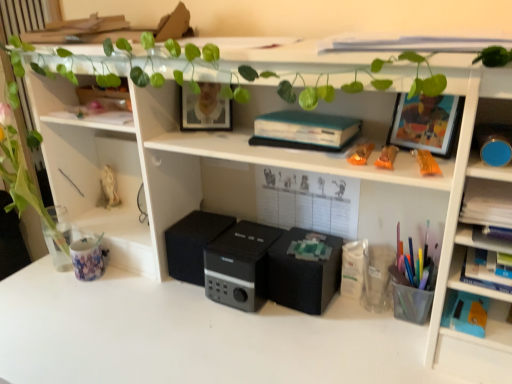
Question: Which direction should I rotate to face black matte speaker at center, which is the 1th speaker in left-to-right order, — up or down?

Choices:
 (A) up
 (B) down

Answer: (B)

Question: Is teal matte book at center in front of hardcover book at right?

Choices:
 (A) no
 (B) yes

Answer: (A)

Question: Can you confirm if teal matte book at center is smaller than hardcover book at right?

Choices:
 (A) no
 (B) yes

Answer: (B)

Question: Does teal matte book at center appear on the right side of hardcover book at right?

Choices:
 (A) yes
 (B) no

Answer: (B)

Question: From the image's perspective, is teal matte book at center located beneath hardcover book at right?

Choices:
 (A) yes
 (B) no

Answer: (B)

Question: Considering the relative sizes of teal matte book at center and hardcover book at right in the image provided, is teal matte book at center wider than hardcover book at right?

Choices:
 (A) yes
 (B) no

Answer: (B)

Question: Is teal matte book at center outside of hardcover book at right?

Choices:
 (A) yes
 (B) no

Answer: (A)

Question: Are translucent orange pen at upper right, arranged as the 2th stationery when viewed from the right, and black matte speaker at center, the 3th speaker in the left-to-right sequence, making contact?

Choices:
 (A) no
 (B) yes

Answer: (A)

Question: Does translucent orange pen at upper right, which appears as the 1th stationery when viewed from the front, have a larger size compared to black matte speaker at center, the 3th speaker in the left-to-right sequence?

Choices:
 (A) no
 (B) yes

Answer: (A)

Question: Is translucent orange pen at upper right, arranged as the 2th stationery when viewed from the right, looking in the opposite direction of black matte speaker at center, positioned as the first speaker in right-to-left order?

Choices:
 (A) no
 (B) yes

Answer: (A)

Question: From the image's perspective, would you say translucent orange pen at upper right, arranged as the 2th stationery when viewed from the right, is positioned over black matte speaker at center, positioned as the first speaker in right-to-left order?

Choices:
 (A) no
 (B) yes

Answer: (B)

Question: Is translucent orange pen at upper right, the 2th stationery viewed from the left, positioned before black matte speaker at center, positioned as the first speaker in right-to-left order?

Choices:
 (A) yes
 (B) no

Answer: (A)

Question: Can you confirm if translucent orange pen at upper right, which is the 3th stationery from back to front, is smaller than black matte speaker at center, positioned as the first speaker in right-to-left order?

Choices:
 (A) yes
 (B) no

Answer: (A)

Question: Is black matte speaker at center, the 3th speaker in the left-to-right sequence, oriented towards translucent plastic cup at right, which is counted as the 1th stationery, starting from the bottom?

Choices:
 (A) no
 (B) yes

Answer: (A)